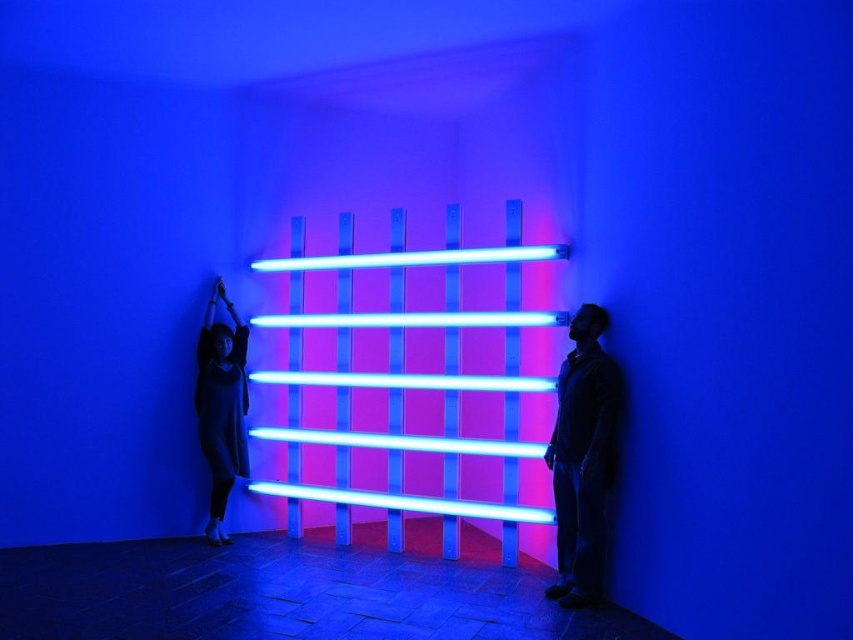
In the scene shown: Does matte black shirt at right have a lesser width compared to matte black dress at left?

In fact, matte black shirt at right might be wider than matte black dress at left.

Is matte black shirt at right shorter than matte black dress at left?

Yes, matte black shirt at right is shorter than matte black dress at left.

Between point (602, 308) and point (222, 362), which one is positioned behind?

The point (222, 362) is more distant.

At what (x,y) coordinates should I click in order to perform the action: click on matte black shirt at right. Please return your answer as a coordinate pair (x, y). Image resolution: width=853 pixels, height=640 pixels. Looking at the image, I should click on (583, 458).